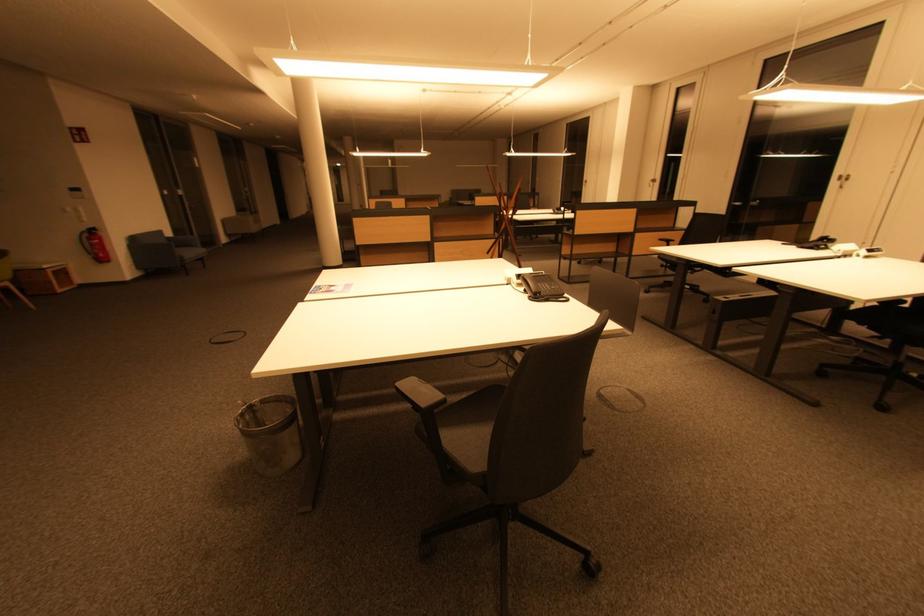
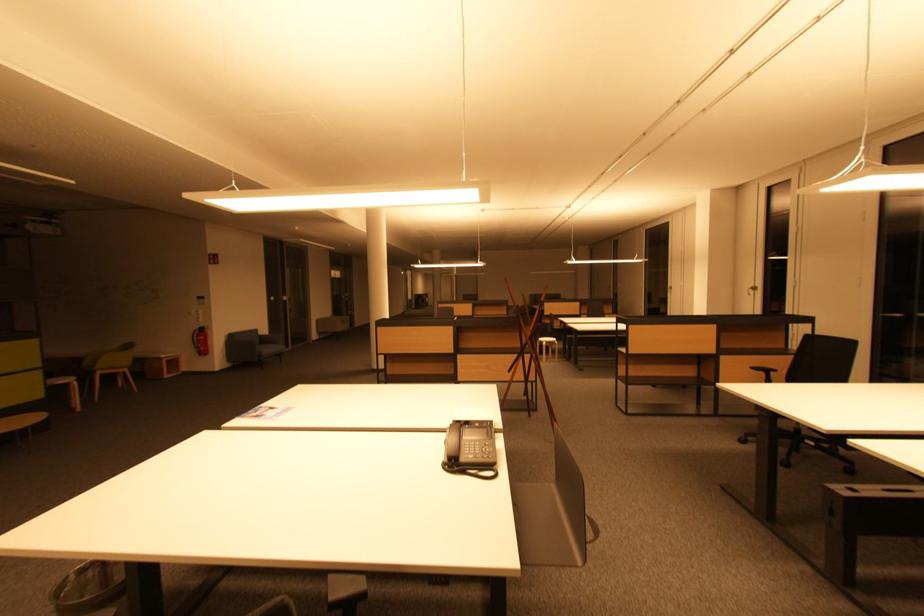
Find the pixel in the second image that matches (x=105, y=259) in the first image.

(207, 353)